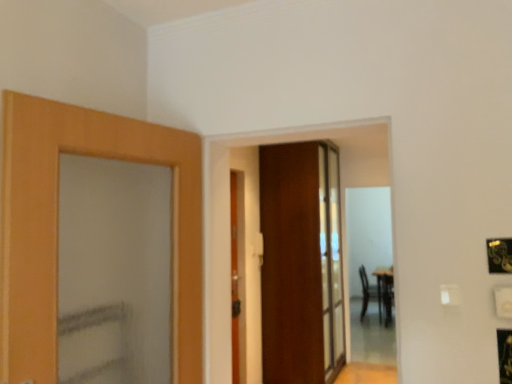
Question: From the image's perspective, is wooden door at center, acting as the 2th door starting from the front, located above or below wooden door at center, acting as the 1th door starting from the front?

Choices:
 (A) above
 (B) below

Answer: (A)

Question: Based on their sizes in the image, would you say wooden door at center, the 2th door from the left, is bigger or smaller than wooden door at center, acting as the 1th door starting from the front?

Choices:
 (A) big
 (B) small

Answer: (A)

Question: Estimate the real-world distances between objects in this image. Which object is closer to the wooden door at center, the 2th door from the left?

Choices:
 (A) wooden door at center, acting as the 2th door starting from the right
 (B) black leather armchair at right

Answer: (A)

Question: Estimate the real-world distances between objects in this image. Which object is farther from the wooden door at center, which ranks as the first door in left-to-right order?

Choices:
 (A) wooden door at center, the 1th door when ordered from right to left
 (B) black leather armchair at right

Answer: (B)